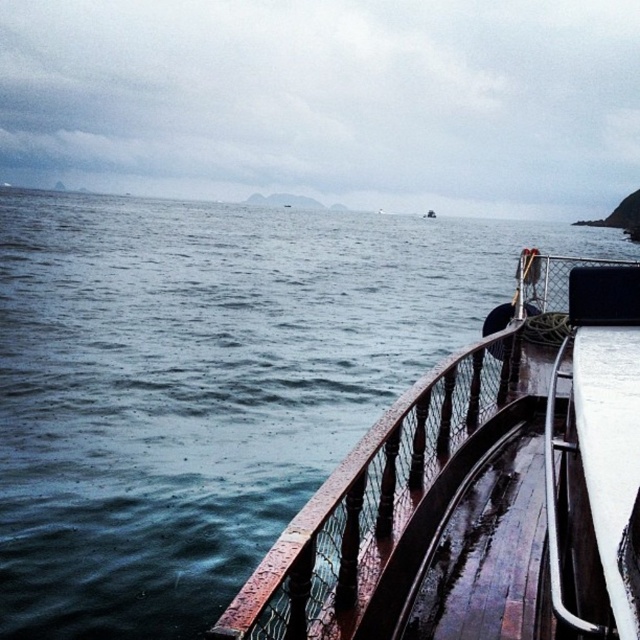
You are standing on the boat deck and want to compare the width of the dark blue water at left and the rustic wood rail at lower right. Which one is wider?

The dark blue water at left is wider than the rustic wood rail at lower right.

You are standing on the boat deck and want to look at the dark blue water at left. Which direction should you move relative to the rustic wood rail at lower right?

You should move to the right of the rustic wood rail at lower right because the dark blue water at left is located to the right of it.

You are standing on the boat deck and want to walk from point A to point B. Point A is at coordinates point (x=115, y=317) and point B is at coordinates point (x=412, y=424). Which point is closer to the edge of the deck?

Point (x=115, y=317) is behind point (x=412, y=424), so point B is closer to the edge of the deck.